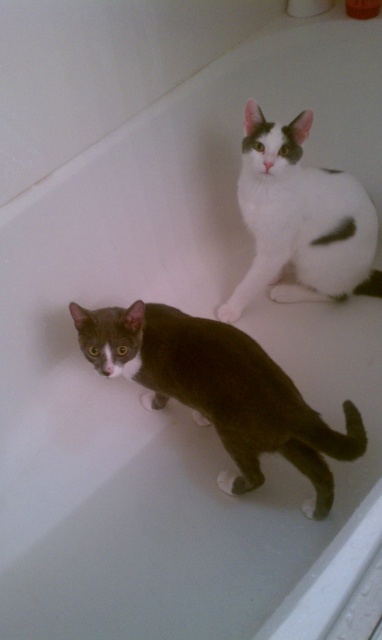
Can you confirm if dark gray fur cat at lower center is positioned above white matte fur cat at upper right?

No.

Which is more to the right, dark gray fur cat at lower center or white matte fur cat at upper right?

white matte fur cat at upper right is more to the right.

Describe the element at coordinates (221, 390) in the screenshot. I see `dark gray fur cat at lower center` at that location.

Locate an element on the screen. dark gray fur cat at lower center is located at coordinates (221, 390).